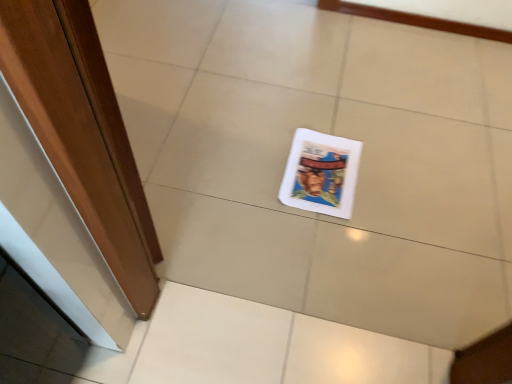
This screenshot has width=512, height=384. In order to click on wooden door at left in this screenshot , I will do pyautogui.click(x=82, y=132).

Image resolution: width=512 pixels, height=384 pixels. What do you see at coordinates (82, 132) in the screenshot?
I see `wooden door at left` at bounding box center [82, 132].

In order to click on white glossy magazine at center in this screenshot , I will do [321, 173].

Image resolution: width=512 pixels, height=384 pixels. What do you see at coordinates (321, 173) in the screenshot?
I see `white glossy magazine at center` at bounding box center [321, 173].

At what (x,y) coordinates should I click in order to perform the action: click on wooden door at left. Please return your answer as a coordinate pair (x, y). This screenshot has height=384, width=512. Looking at the image, I should click on (82, 132).

Considering the relative positions of wooden door at left and white glossy magazine at center in the image provided, is wooden door at left to the left of white glossy magazine at center from the viewer's perspective?

Yes.

Relative to white glossy magazine at center, is wooden door at left in front or behind?

wooden door at left is in front of white glossy magazine at center.

Considering the points (130, 274) and (332, 210), which point is in front, point (130, 274) or point (332, 210)?

The point (130, 274) is closer.

From the image's perspective, relative to white glossy magazine at center, is wooden door at left above or below?

Based on their image positions, wooden door at left is located above white glossy magazine at center.

From a real-world perspective, between wooden door at left and white glossy magazine at center, who is vertically lower?

From a 3D spatial view, white glossy magazine at center is below.

Looking at this image, which of these two, wooden door at left or white glossy magazine at center, is thinner?

wooden door at left is thinner.

Does wooden door at left have a greater height compared to white glossy magazine at center?

Indeed, wooden door at left has a greater height compared to white glossy magazine at center.

From the picture: Which of these two, wooden door at left or white glossy magazine at center, is smaller?

With smaller size is white glossy magazine at center.

Is wooden door at left located outside white glossy magazine at center?

wooden door at left is positioned outside white glossy magazine at center.

Is wooden door at left far away from white glossy magazine at center?

No, there isn't a large distance between wooden door at left and white glossy magazine at center.

Could you tell me if wooden door at left is facing white glossy magazine at center?

Yes, wooden door at left is oriented towards white glossy magazine at center.

How different are the orientations of wooden door at left and white glossy magazine at center in degrees?

129 degrees.

Consider the image. How distant is wooden door at left from white glossy magazine at center?

wooden door at left is 23.76 inches away from white glossy magazine at center.

Where is `magazine that appears behind the wooden door at left`? magazine that appears behind the wooden door at left is located at coordinates (321, 173).

Is white glossy magazine at center at the right side of wooden door at left?

Indeed, white glossy magazine at center is positioned on the right side of wooden door at left.

Is white glossy magazine at center in front of or behind wooden door at left in the image?

white glossy magazine at center is positioned farther from the viewer than wooden door at left.

Considering the points (360, 144) and (71, 144), which point is in front, point (360, 144) or point (71, 144)?

The point (71, 144) is closer.

From the image's perspective, is white glossy magazine at center under wooden door at left?

Yes.

From a real-world perspective, is white glossy magazine at center below wooden door at left?

Yes.

Looking at their sizes, would you say white glossy magazine at center is wider or thinner than wooden door at left?

white glossy magazine at center is wider than wooden door at left.

Can you confirm if white glossy magazine at center is taller than wooden door at left?

No.

Between white glossy magazine at center and wooden door at left, which one has larger size?

wooden door at left is bigger.

Choose the correct answer: Is white glossy magazine at center inside wooden door at left or outside it?

white glossy magazine at center cannot be found inside wooden door at left.

Consider the image. Is white glossy magazine at center positioned far away from wooden door at left?

No, white glossy magazine at center is not far from wooden door at left.

Is white glossy magazine at center facing away from wooden door at left?

white glossy magazine at center is not turned away from wooden door at left.

What's the angular difference between white glossy magazine at center and wooden door at left's facing directions?

They differ by 129 degrees in their facing directions.

Where is `door that appears above the white glossy magazine at center (from a real-world perspective)`? This screenshot has height=384, width=512. door that appears above the white glossy magazine at center (from a real-world perspective) is located at coordinates (82, 132).

The width and height of the screenshot is (512, 384). I want to click on magazine behind the wooden door at left, so click(x=321, y=173).

Where is `door above the white glossy magazine at center (from the image's perspective)`? Image resolution: width=512 pixels, height=384 pixels. door above the white glossy magazine at center (from the image's perspective) is located at coordinates (82, 132).